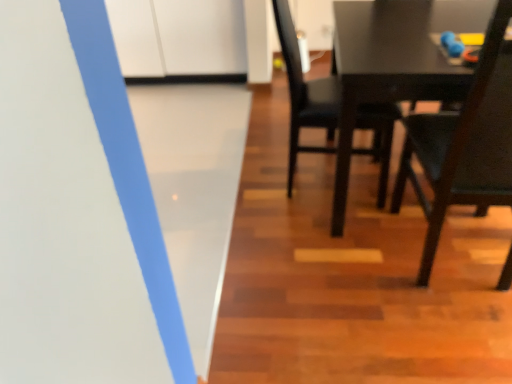
Question: From a real-world perspective, is matte black chair at center, the second chair in the right-to-left sequence, on top of dark wood chair at right, the first chair when ordered from right to left?

Choices:
 (A) no
 (B) yes

Answer: (A)

Question: Considering the relative positions of matte black chair at center, marked as the first chair in a left-to-right arrangement, and dark wood chair at right, the first chair when ordered from right to left, in the image provided, is matte black chair at center, marked as the first chair in a left-to-right arrangement, to the right of dark wood chair at right, the first chair when ordered from right to left, from the viewer's perspective?

Choices:
 (A) no
 (B) yes

Answer: (A)

Question: Is matte black chair at center, marked as the first chair in a left-to-right arrangement, wider than dark wood chair at right, the first chair when ordered from right to left?

Choices:
 (A) no
 (B) yes

Answer: (A)

Question: Is dark wood chair at right, the 2th chair viewed from the left, completely or partially inside matte black chair at center, the second chair in the right-to-left sequence?

Choices:
 (A) yes
 (B) no

Answer: (B)

Question: Is matte black chair at center, the second chair in the right-to-left sequence, bigger than dark wood chair at right, the first chair when ordered from right to left?

Choices:
 (A) no
 (B) yes

Answer: (A)

Question: Is matte black chair at center, marked as the first chair in a left-to-right arrangement, taller than dark wood chair at right, the 2th chair viewed from the left?

Choices:
 (A) no
 (B) yes

Answer: (A)

Question: Can you confirm if dark wood chair at right, the 2th chair viewed from the left, is bigger than matte black chair at center, marked as the first chair in a left-to-right arrangement?

Choices:
 (A) no
 (B) yes

Answer: (B)

Question: Is dark wood chair at right, the first chair when ordered from right to left, facing towards matte black chair at center, the second chair in the right-to-left sequence?

Choices:
 (A) yes
 (B) no

Answer: (B)

Question: Considering the relative sizes of dark wood chair at right, the first chair when ordered from right to left, and matte black chair at center, marked as the first chair in a left-to-right arrangement, in the image provided, is dark wood chair at right, the first chair when ordered from right to left, smaller than matte black chair at center, marked as the first chair in a left-to-right arrangement,?

Choices:
 (A) yes
 (B) no

Answer: (B)

Question: Is dark wood chair at right, the first chair when ordered from right to left, directly adjacent to matte black chair at center, the second chair in the right-to-left sequence?

Choices:
 (A) no
 (B) yes

Answer: (A)

Question: Is dark wood chair at right, the first chair when ordered from right to left, to the left of matte black chair at center, marked as the first chair in a left-to-right arrangement, from the viewer's perspective?

Choices:
 (A) yes
 (B) no

Answer: (B)

Question: From a real-world perspective, is dark wood chair at right, the first chair when ordered from right to left, over matte black chair at center, marked as the first chair in a left-to-right arrangement?

Choices:
 (A) yes
 (B) no

Answer: (A)

Question: Based on their sizes in the image, would you say dark wood chair at right, the 2th chair viewed from the left, is bigger or smaller than matte black chair at center, the second chair in the right-to-left sequence?

Choices:
 (A) big
 (B) small

Answer: (A)